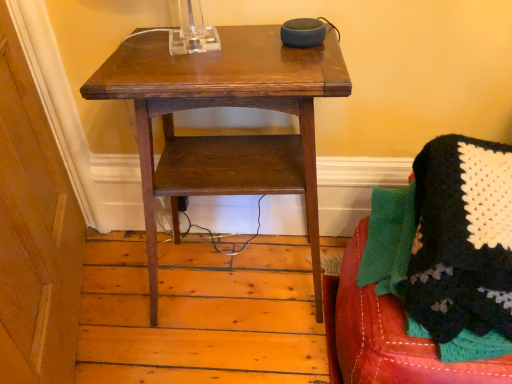
The height and width of the screenshot is (384, 512). Find the location of `vacant area that is in front of wooden table at center`. vacant area that is in front of wooden table at center is located at coordinates (233, 350).